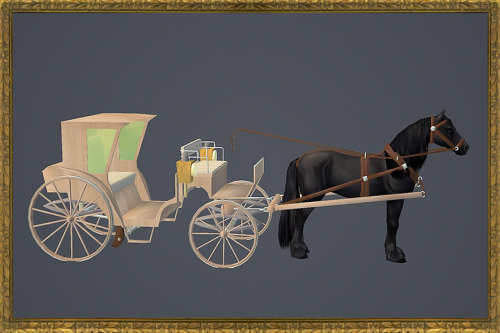
This screenshot has height=333, width=500. Identify the location of foot rest. (236, 190), (145, 207).